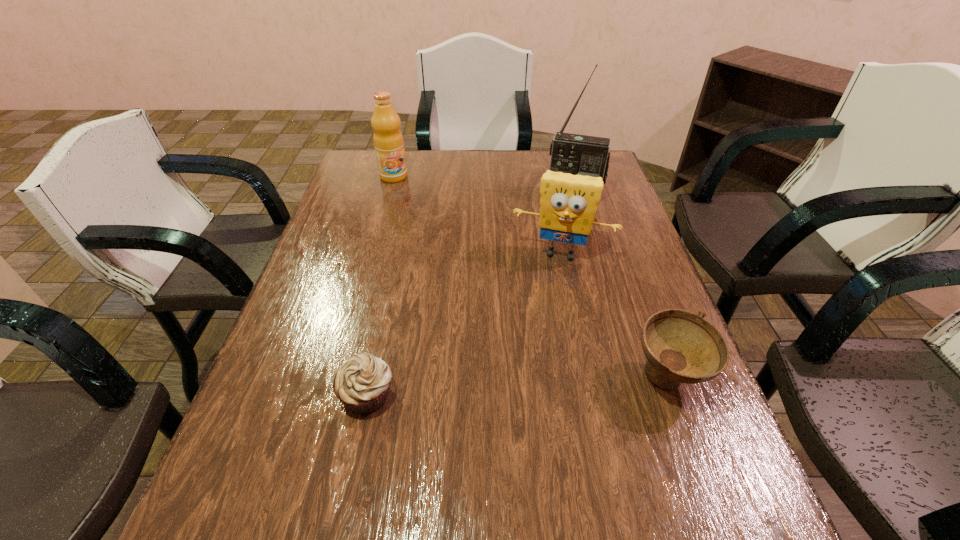
The height and width of the screenshot is (540, 960). What are the coordinates of `the shortest object` in the screenshot? It's located at (362, 383).

The width and height of the screenshot is (960, 540). Find the location of `soup bowl`. soup bowl is located at coordinates (681, 346).

Identify the location of the tallest object. (576, 154).

Identify the location of the fourth nearest object. (576, 154).

Find the location of a particular element. the fourth shortest object is located at coordinates (388, 141).

Find the location of a particular element. This screenshot has height=540, width=960. the farthest object is located at coordinates (388, 141).

The width and height of the screenshot is (960, 540). In order to click on the third farthest object in this screenshot , I will do `click(568, 202)`.

What are the coordinates of `the third tallest object` in the screenshot? It's located at tap(568, 202).

Image resolution: width=960 pixels, height=540 pixels. I want to click on free space located 0.280m on the back of the muffin, so click(392, 280).

Identify the location of blank area located on the left of the second shortest object. (437, 379).